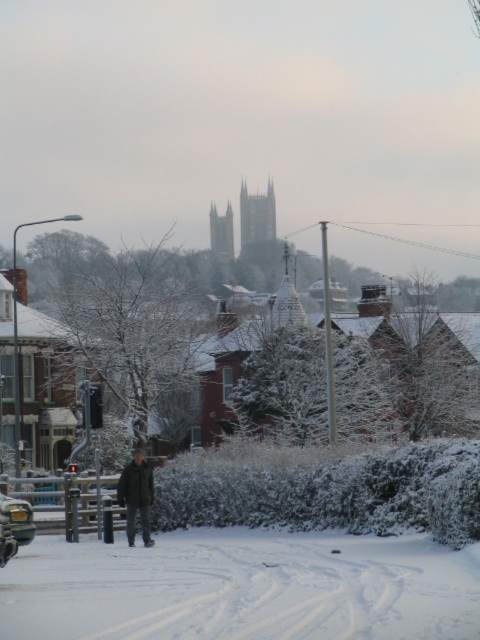
Question: Is dark brown leather jacket at center to the left of metallic silver car at lower left from the viewer's perspective?

Choices:
 (A) no
 (B) yes

Answer: (A)

Question: Where is white powdery snow at lower center located in relation to metallic silver car at lower left in the image?

Choices:
 (A) above
 (B) below

Answer: (B)

Question: Estimate the real-world distances between objects in this image. Which object is farther from the metallic silver car at lower left?

Choices:
 (A) white powdery snow at lower center
 (B) dark brown leather jacket at center

Answer: (A)

Question: Does dark brown leather jacket at center appear on the left side of metallic silver car at lower left?

Choices:
 (A) yes
 (B) no

Answer: (B)

Question: Estimate the real-world distances between objects in this image. Which object is farther from the white powdery snow at lower center?

Choices:
 (A) metallic silver car at lower left
 (B) dark brown leather jacket at center

Answer: (B)

Question: Among these objects, which one is farthest from the camera?

Choices:
 (A) white powdery snow at lower center
 (B) metallic silver car at lower left
 (C) dark brown leather jacket at center

Answer: (C)